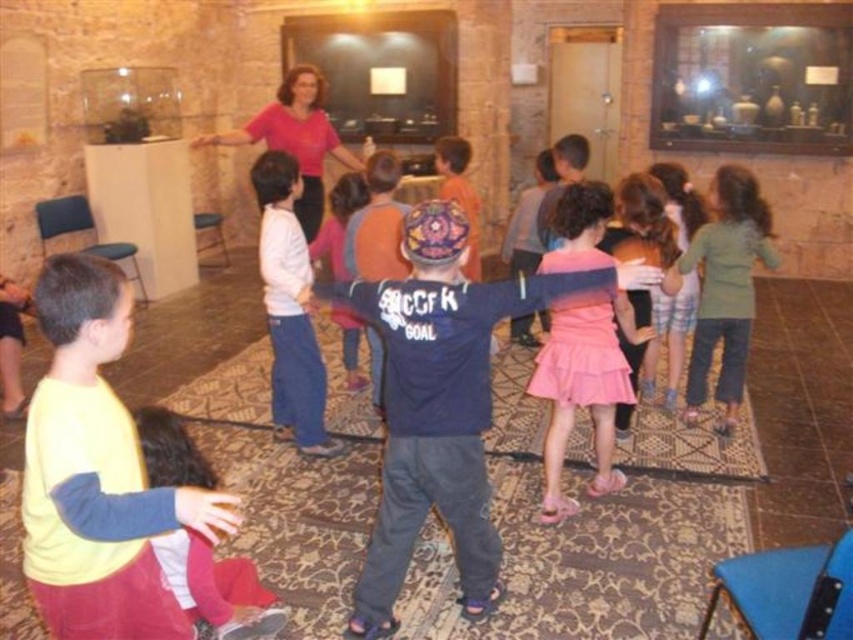
Question: Which object appears farthest from the camera in this image?

Choices:
 (A) pink satin dress at center
 (B) yellow long-sleeve shirt at lower left
 (C) green cotton shirt at center

Answer: (C)

Question: Does yellow long-sleeve shirt at lower left lie behind pink satin dress at center?

Choices:
 (A) yes
 (B) no

Answer: (B)

Question: Does pink satin dress at center have a greater width compared to green cotton shirt at center?

Choices:
 (A) yes
 (B) no

Answer: (A)

Question: Which point appears farthest from the camera in this image?

Choices:
 (A) (711, 221)
 (B) (621, 323)

Answer: (A)

Question: Considering the real-world distances, which object is closest to the yellow long-sleeve shirt at lower left?

Choices:
 (A) green cotton shirt at center
 (B) pink satin dress at center

Answer: (B)

Question: Is pink satin dress at center below green cotton shirt at center?

Choices:
 (A) no
 (B) yes

Answer: (B)